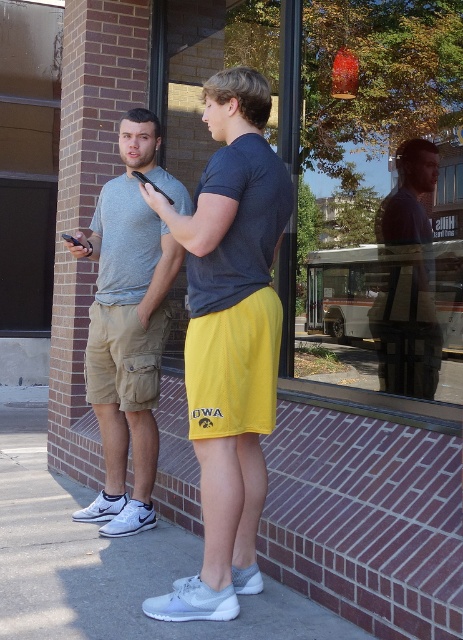
You are a photographer positioned 3 meters away from the yellow athletic shorts at center. Can you take a clear photo of the shorts without moving closer?

The yellow athletic shorts at center and the viewer are 2.69 meters apart. Since you are positioned 3 meters away, you are 0.31 meters farther than the stated distance. Whether you can take a clear photo depends on your camera quality, but the distance is relatively close enough for most cameras to capture a clear image.

You are a photographer trying to capture a clear image of both the yellow athletic shorts at center and the matte gray shirt at center. Which clothing item is located to the left of the other?

The yellow athletic shorts at center is positioned on the left side of matte gray shirt at center.

You are a photographer adjusting your camera settings. You notice two points in the frame at coordinates point (193, 252) and point (398, 161). Which point should you focus on to ensure it appears sharp in the final photo if you want the closer one to be in focus?

You should focus on point (193, 252) because it is closer to the camera than point (398, 161), so focusing on the closer point will ensure it appears sharp.